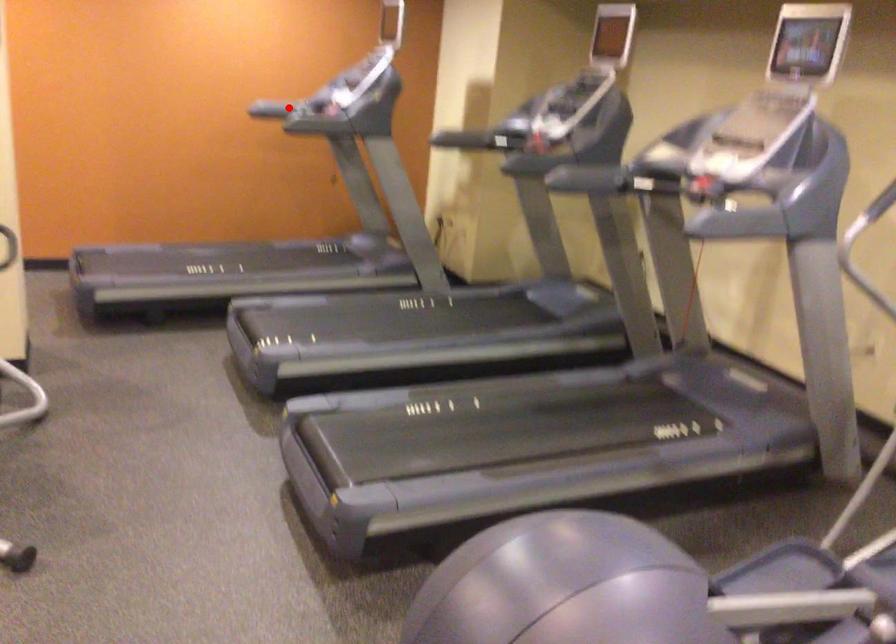
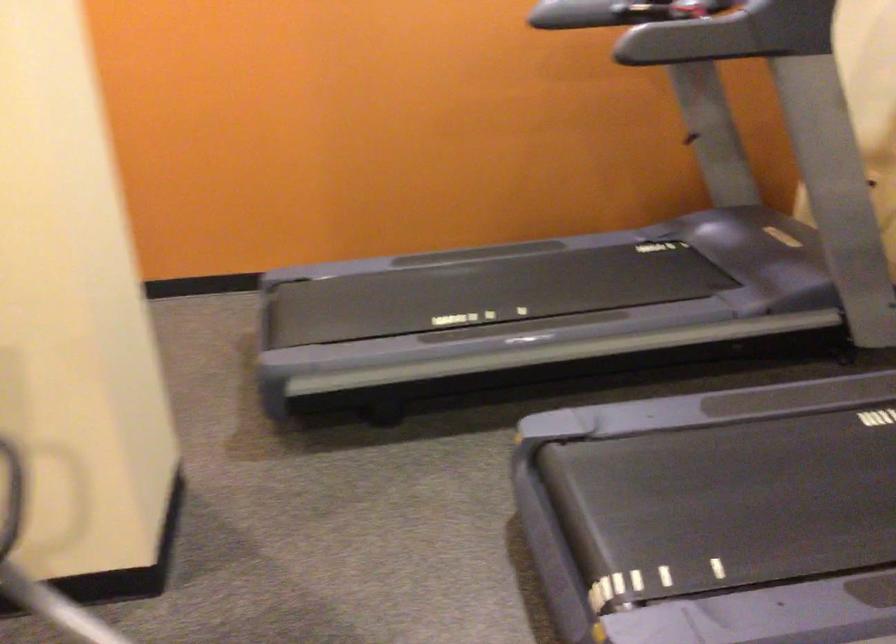
Question: I am providing you with two images of the same scene from different viewpoints. A red point is shown in image1. For the corresponding object point in image2, is it positioned nearer or farther from the camera?

Choices:
 (A) Nearer
 (B) Farther

Answer: (A)